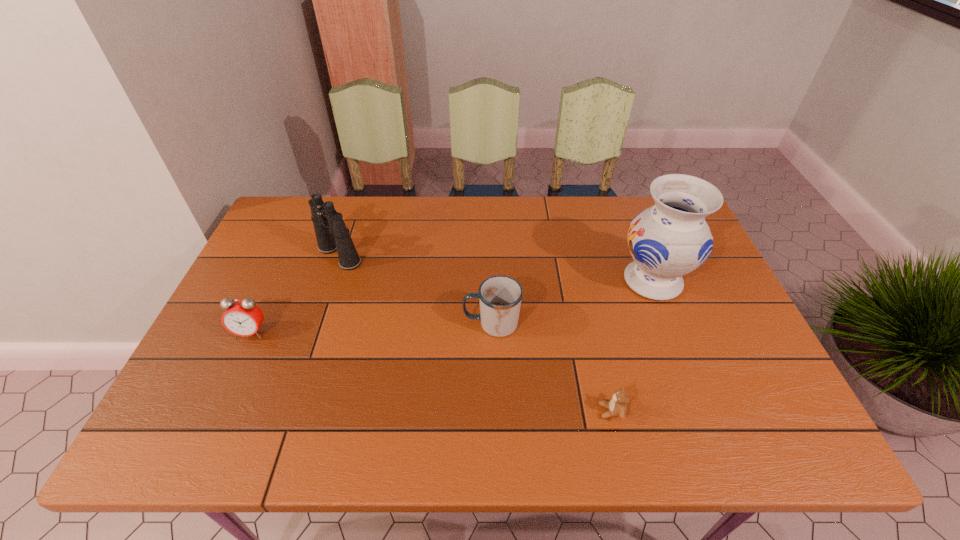
This screenshot has width=960, height=540. I want to click on vacant space in between the vase and the second object from left to right, so click(496, 268).

This screenshot has height=540, width=960. I want to click on free space that is in between the mug and the fourth shortest object, so click(x=416, y=289).

Find the location of a particular element. The height and width of the screenshot is (540, 960). vacant area between the teddy bear and the tallest object is located at coordinates (632, 346).

The image size is (960, 540). I want to click on free space between the second object from left to right and the third object from right to left, so click(416, 289).

You are a GUI agent. You are given a task and a screenshot of the screen. Output one action in this format:
    pyautogui.click(x=<x>, y=<y>)
    Task: Click on the vacant space that is in between the rightmost object and the teddy bear
    This screenshot has width=960, height=540.
    Given the screenshot: What is the action you would take?
    pyautogui.click(x=632, y=346)

Locate which object ranks fourth in proximity to the fourth object from right to left. Please provide its 2D coordinates. Your answer should be formatted as a tuple, i.e. [(x, y)], where the tuple contains the x and y coordinates of a point satisfying the conditions above.

[(670, 239)]

Image resolution: width=960 pixels, height=540 pixels. I want to click on object identified as the fourth closest to the mug, so click(243, 318).

Find the location of a particular element. free space that satisfies the following two spatial constraints: 1. on the handle side of the third object from right to left; 2. on the front-facing side of the leftmost object is located at coordinates (492, 332).

At what (x,y) coordinates should I click in order to perform the action: click on vacant region that satisfies the following two spatial constraints: 1. on the front side of the fourth shortest object; 2. on the right side of the tallest object. Please return your answer as a coordinate pair (x, y). The width and height of the screenshot is (960, 540). Looking at the image, I should click on (331, 281).

Where is `vacant space that satisfies the following two spatial constraints: 1. on the handle side of the mug; 2. on the front-facing side of the alarm clock`? The height and width of the screenshot is (540, 960). vacant space that satisfies the following two spatial constraints: 1. on the handle side of the mug; 2. on the front-facing side of the alarm clock is located at coordinates (492, 332).